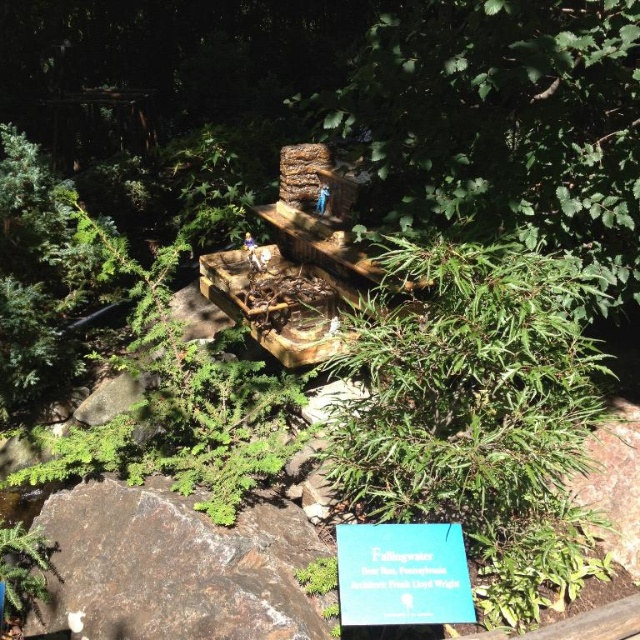
Question: In this image, where is green leafy tree at center located relative to green leafy plant at lower left?

Choices:
 (A) left
 (B) right

Answer: (B)

Question: Which point is farther from the camera taking this photo?

Choices:
 (A) (19, 573)
 (B) (632, 154)
 (C) (401, 577)

Answer: (B)

Question: Can you confirm if green leafy tree at center is positioned below blue paper sign at lower center?

Choices:
 (A) no
 (B) yes

Answer: (A)

Question: Does blue paper sign at lower center appear over green leafy plant at lower left?

Choices:
 (A) no
 (B) yes

Answer: (B)

Question: Considering the real-world distances, which object is farthest from the green leafy plant at lower left?

Choices:
 (A) green leafy tree at center
 (B) blue paper sign at lower center

Answer: (A)

Question: Which of the following is the closest to the observer?

Choices:
 (A) green leafy plant at lower left
 (B) green leafy tree at center
 (C) blue paper sign at lower center

Answer: (C)